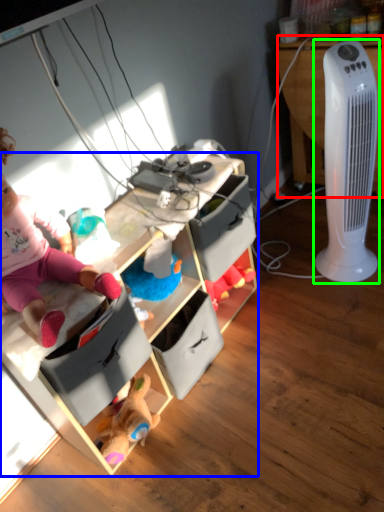
Question: Which object is the farthest from desk (highlighted by a red box)? Choose among these: cabinetry (highlighted by a blue box) or home appliance (highlighted by a green box).

Choices:
 (A) cabinetry
 (B) home appliance

Answer: (A)